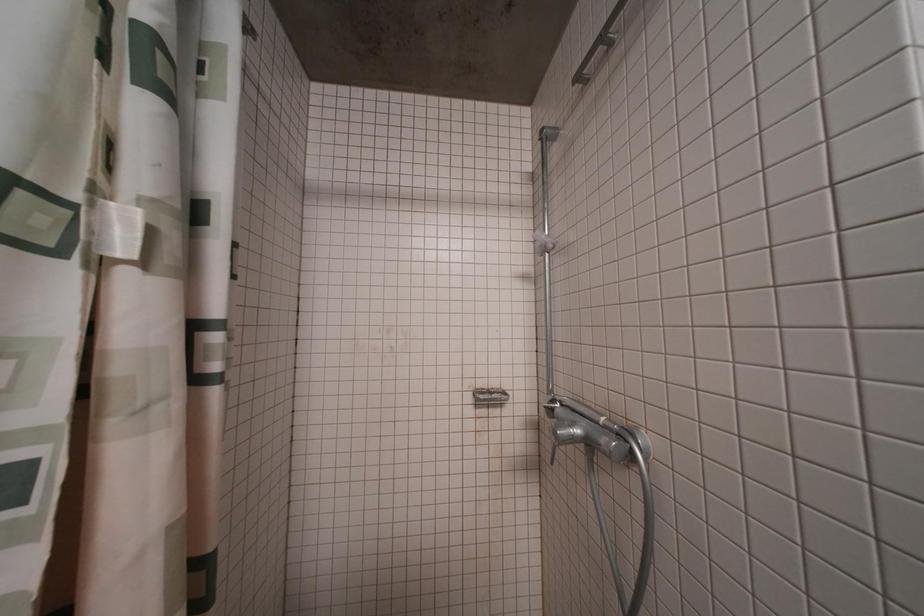
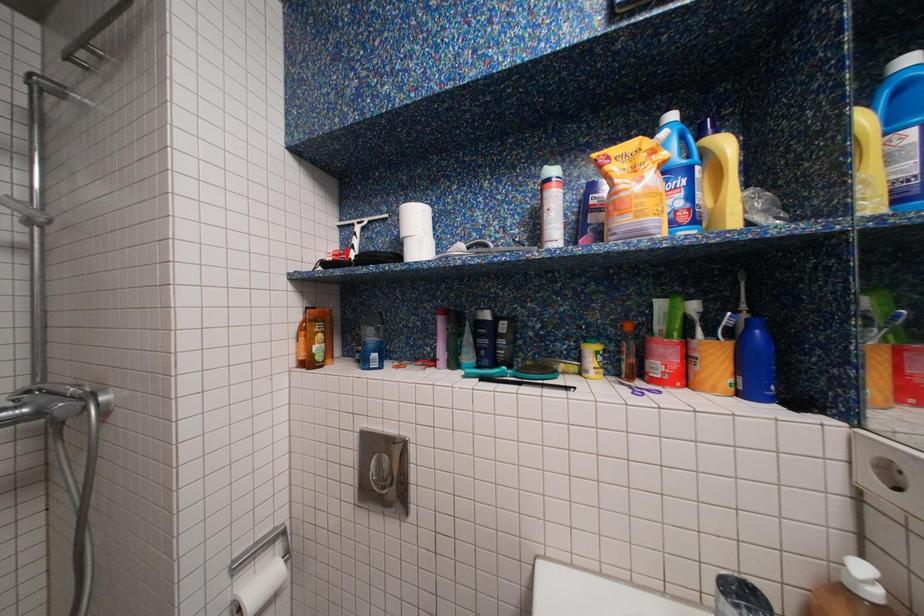
Question: The camera is either moving clockwise (left) or counter-clockwise (right) around the object. The first image is from the beginning of the video and the second image is from the end. Is the camera moving left or right when shooting the video?

Choices:
 (A) Left
 (B) Right

Answer: (A)